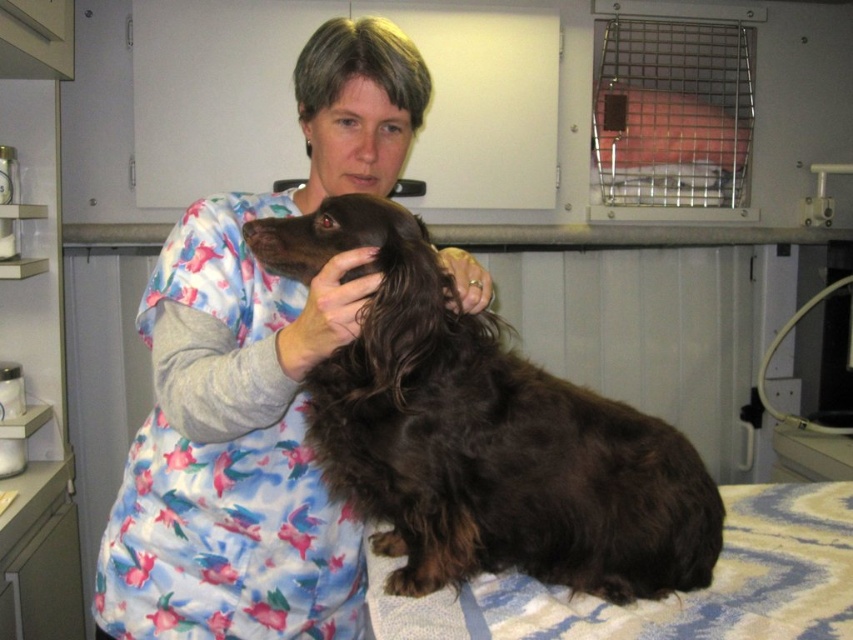
Question: Which object appears farthest from the camera in this image?

Choices:
 (A) brown furry dog at center
 (B) fluffy brown dog at center

Answer: (B)

Question: Can you confirm if fluffy brown dog at center is wider than brown furry dog at center?

Choices:
 (A) yes
 (B) no

Answer: (B)

Question: Among these points, which one is nearest to the camera?

Choices:
 (A) (312, 403)
 (B) (201, 445)

Answer: (A)

Question: From the image, what is the correct spatial relationship of fluffy brown dog at center in relation to brown furry dog at center?

Choices:
 (A) left
 (B) right

Answer: (A)

Question: Does fluffy brown dog at center come behind brown furry dog at center?

Choices:
 (A) yes
 (B) no

Answer: (A)

Question: Among these points, which one is farthest from the camera?

Choices:
 (A) (322, 38)
 (B) (643, 572)

Answer: (A)